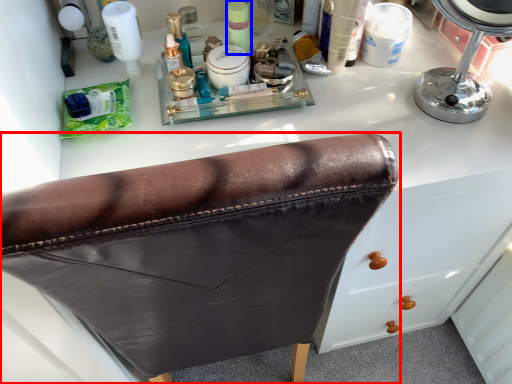
Question: Which object is closer to the camera taking this photo, furniture (highlighted by a red box) or toiletry (highlighted by a blue box)?

Choices:
 (A) furniture
 (B) toiletry

Answer: (A)